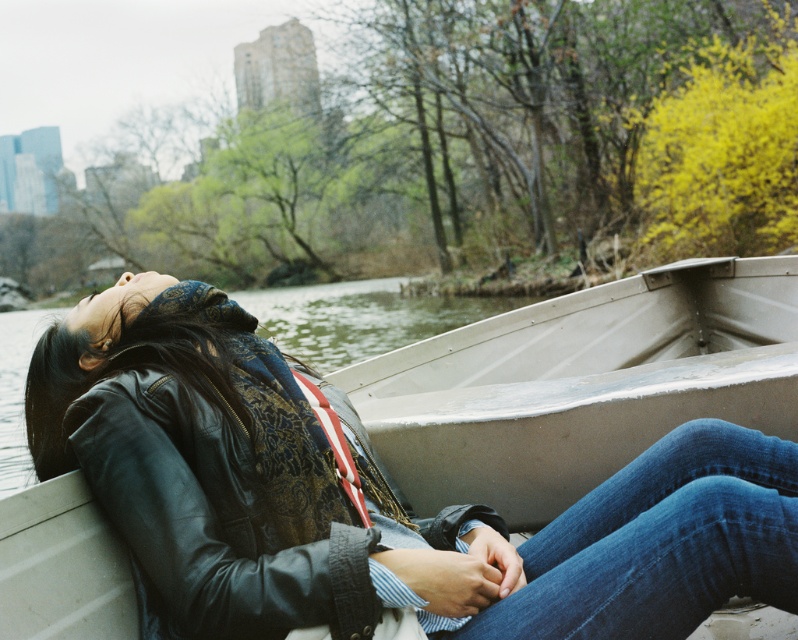
You are a photographer trying to capture the metallic gray canoe at center and the black leather jacket at left in the same frame. Since you want both subjects to be clearly visible, which object should you focus on first to ensure proper depth of field?

The metallic gray canoe at center should be focused on first because it is taller than the black leather jacket at left, so adjusting focus starting from the taller object ensures both are in clear view.

What object is located at the coordinates point (x=581, y=385)?

The metallic gray canoe at center is located at point (x=581, y=385).

You are a photographer positioned at the edge of the water, aiming to capture a clear shot of the metallic gray canoe at center and the denim at center. Based on their positions, which object should you focus on first to ensure both are in sharp focus?

You should focus on the metallic gray canoe at center first because the denim at center is behind it, so focusing on the closer object ensures both will be in focus.